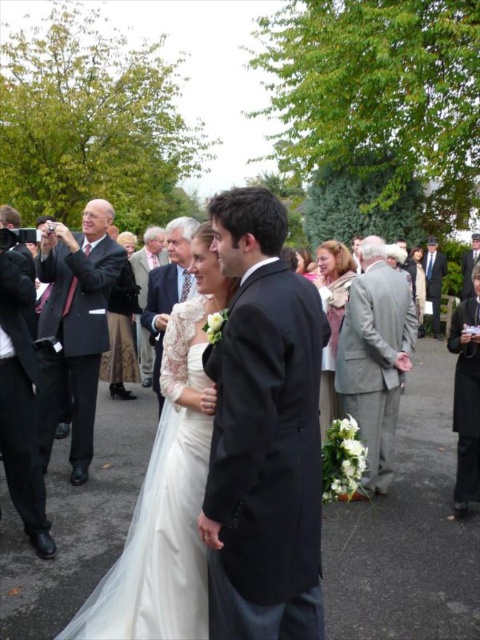
Can you confirm if dark suit at left is taller than light beige fabric coat at center?

Yes, dark suit at left is taller than light beige fabric coat at center.

This screenshot has height=640, width=480. Describe the element at coordinates (75, 326) in the screenshot. I see `dark suit at left` at that location.

Where is `dark suit at left`? This screenshot has width=480, height=640. dark suit at left is located at coordinates (75, 326).

Describe the element at coordinates (467, 396) in the screenshot. I see `black wool suit at right` at that location.

The image size is (480, 640). What do you see at coordinates (467, 396) in the screenshot?
I see `black wool suit at right` at bounding box center [467, 396].

Identify the location of black wool suit at right. (467, 396).

Does black satin suit at center have a lesser width compared to light beige fabric coat at center?

Correct, black satin suit at center's width is less than light beige fabric coat at center's.

Does black satin suit at center appear on the right side of light beige fabric coat at center?

No, black satin suit at center is not to the right of light beige fabric coat at center.

What do you see at coordinates (264, 433) in the screenshot? I see `black satin suit at center` at bounding box center [264, 433].

This screenshot has height=640, width=480. Identify the location of black satin suit at center. (264, 433).